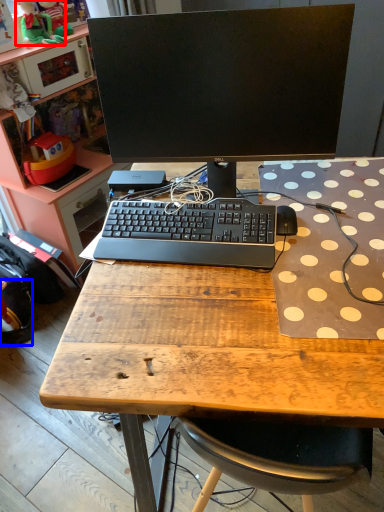
Question: Which point is closer to the camera, toy (highlighted by a red box) or backpack (highlighted by a blue box)?

Choices:
 (A) toy
 (B) backpack

Answer: (B)